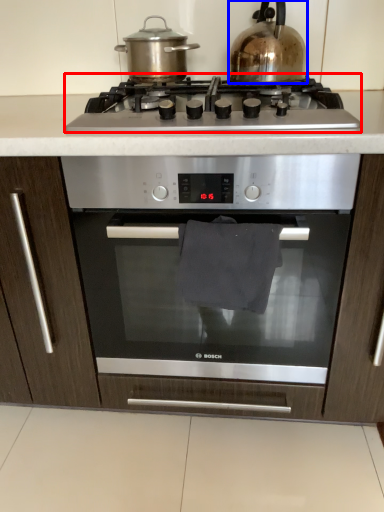
Question: Which of the following is the farthest to the observer, gas stove (highlighted by a red box) or kitchen appliance (highlighted by a blue box)?

Choices:
 (A) gas stove
 (B) kitchen appliance

Answer: (B)